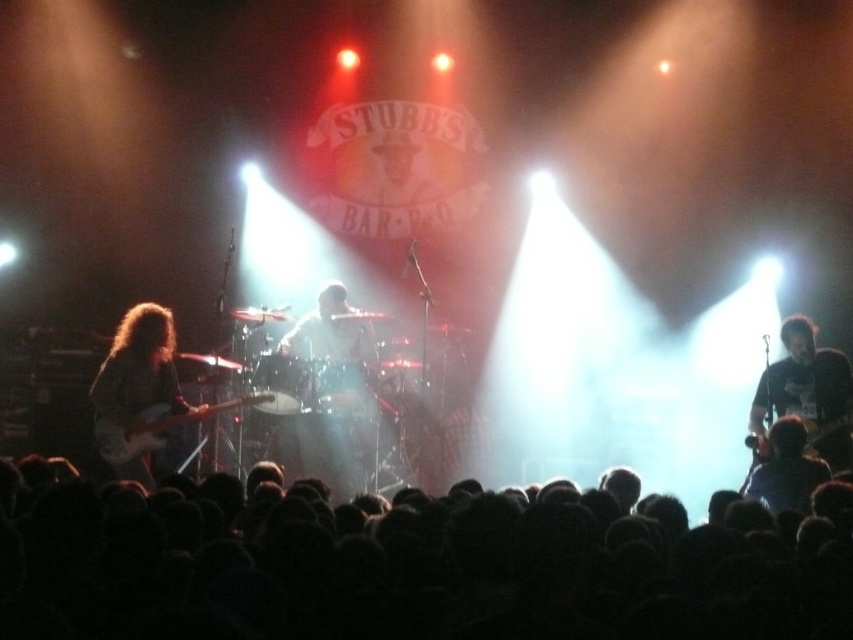
You are a photographer at the concert venue and want to capture a closeup of the black hair at lower center and the matte black electric guitar at left. Given their positions, which one would appear larger in your photo?

The black hair at lower center would appear larger in the photo because it is closer to the viewer than the matte black electric guitar at left.

You are a photographer at Stubbs Bar B Q venue and want to capture a photo of the black matte guitar at right and the dark blue shirt at lower right. Since you want to emphasize the guitar, which object should you focus on and why?

You should focus on the black matte guitar at right because its width surpasses that of the dark blue shirt at lower right, making it a larger and more prominent subject in the frame.

From the picture: You are a photographer at the concert and want to capture a clear shot of both the black hair at lower center and the matte black electric guitar at left. Considering their heights, which one might appear smaller in the photo?

The black hair at lower center has a lesser height compared to the matte black electric guitar at left, so it will appear smaller in the photo.